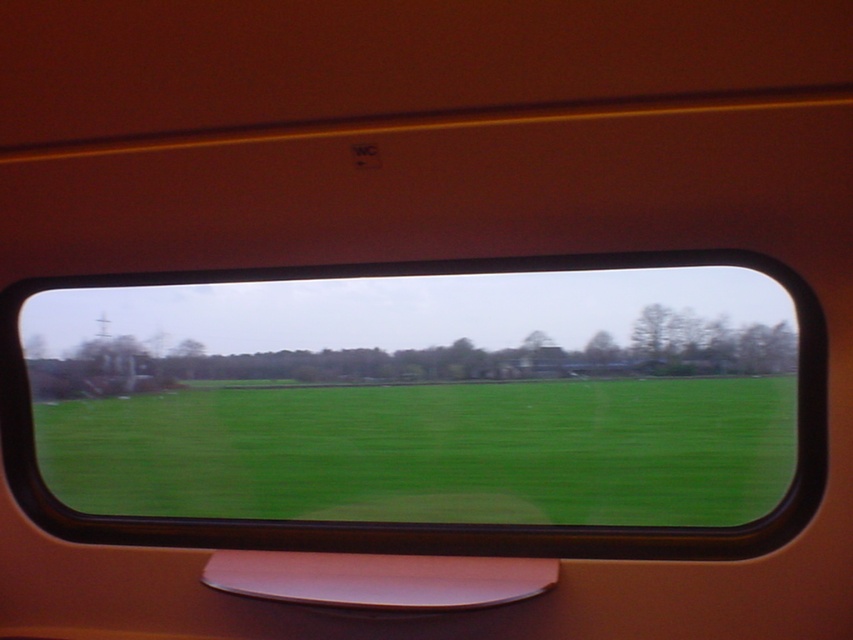
Question: Is the position of green matte field at center more distant than that of green grass at center?

Choices:
 (A) yes
 (B) no

Answer: (B)

Question: Does green matte field at center have a smaller size compared to green grass at center?

Choices:
 (A) no
 (B) yes

Answer: (A)

Question: Which point is closer to the camera?

Choices:
 (A) green grass at center
 (B) green matte field at center

Answer: (B)

Question: Is the position of green matte field at center less distant than that of green grass at center?

Choices:
 (A) yes
 (B) no

Answer: (A)

Question: Which object is farther from the camera taking this photo?

Choices:
 (A) green grass at center
 (B) green matte field at center

Answer: (A)